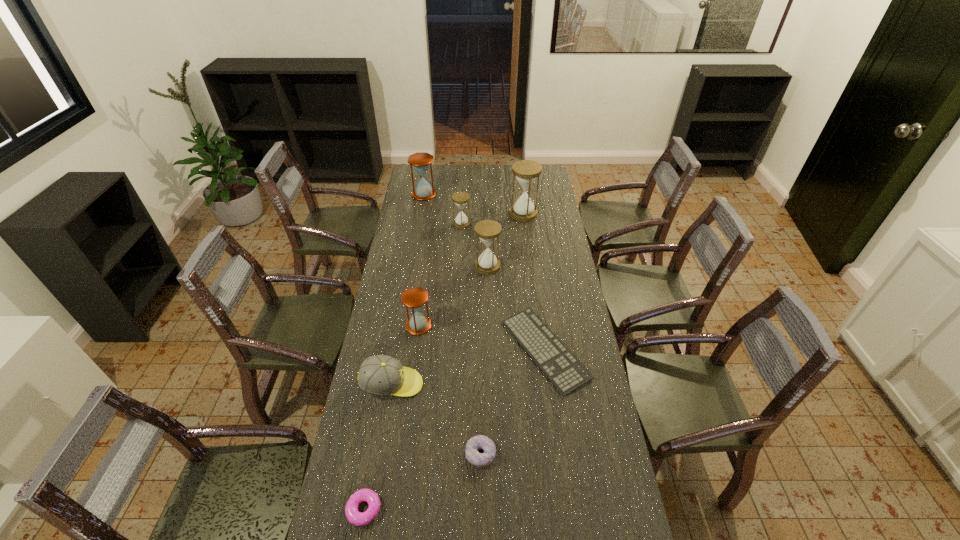
This screenshot has height=540, width=960. Identify the location of the fourth shortest object. (383, 375).

Identify the location of yellow baseball cap. The width and height of the screenshot is (960, 540). (383, 375).

Locate an element on the screen. This screenshot has width=960, height=540. the taller doughnut is located at coordinates [478, 442].

Locate an element on the screen. the third shortest object is located at coordinates (478, 442).

This screenshot has width=960, height=540. What are the coordinates of `the second shortest object` in the screenshot? It's located at (355, 517).

You are a GUI agent. You are given a task and a screenshot of the screen. Output one action in this format:
    pyautogui.click(x=<x>, y=<y>)
    Task: Click on the nearest object
    
    Given the screenshot: What is the action you would take?
    pyautogui.click(x=355, y=517)

The width and height of the screenshot is (960, 540). Identify the location of the shortest object. (562, 368).

I want to click on free region located on the left of the rightmost hourglass, so click(491, 214).

At what (x,y) coordinates should I click in order to perform the action: click on vacant region located on the front of the farther brown hourglass. Please return your answer as a coordinate pair (x, y). Looking at the image, I should click on (422, 206).

The width and height of the screenshot is (960, 540). I want to click on vacant space located 0.380m on the back of the sixth nearest object, so click(487, 211).